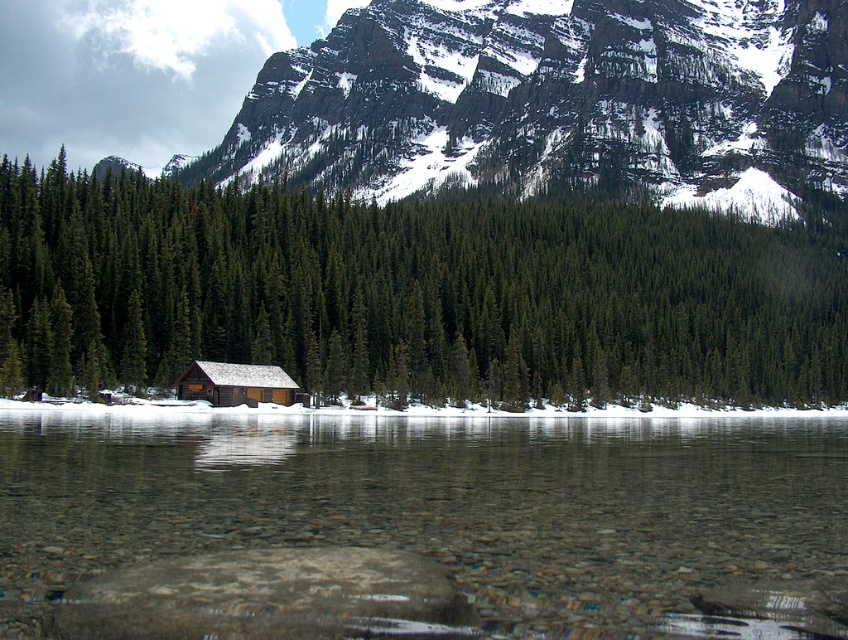
Consider the image. You are standing at the edge of the lake and want to take a photo of both the clear glass water at center and the wooden cabin at center. Which object will appear larger in the photo?

The clear glass water at center will appear larger in the photo because it is closer to the viewer than the wooden cabin at center.

You are standing at the edge of the lake and want to walk to the wooden cabin at center. Which direction should you go relative to the green matte tree at center?

You should head to the left of the green matte tree at center because the wooden cabin at center is located to the left of the green matte tree at center.